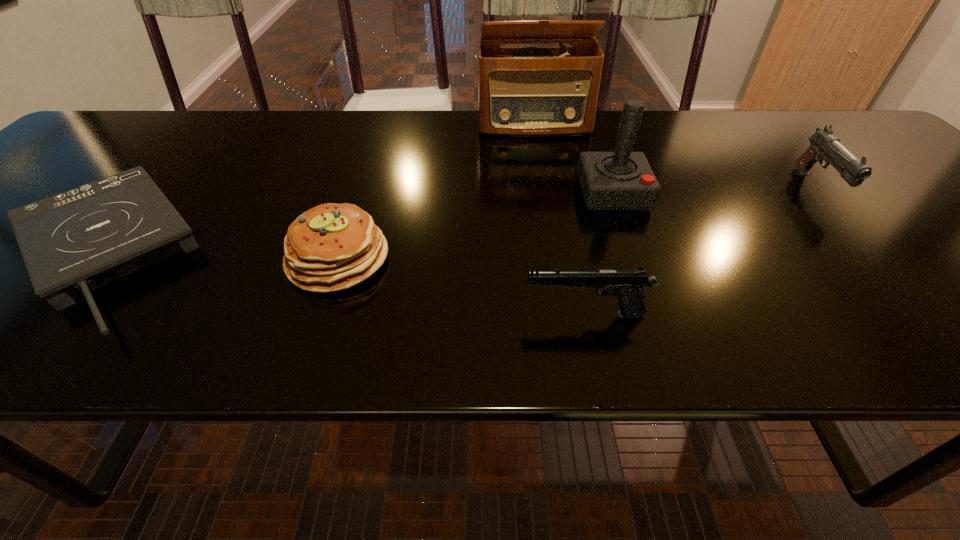
This screenshot has width=960, height=540. What are the coordinates of `empty space that is in between the nearer gun and the fifth object from right to left` in the screenshot? It's located at (462, 286).

I want to click on free spot between the left gun and the fifth shortest object, so click(x=599, y=253).

I want to click on unoccupied position between the fifth object from right to left and the left gun, so click(462, 286).

Identify the location of vacant area that lies between the tallest object and the left gun. This screenshot has width=960, height=540. (560, 219).

This screenshot has height=540, width=960. I want to click on free spot between the second tallest object and the nearer gun, so click(599, 253).

Select which object appears as the fifth closest to the nearer gun. Please provide its 2D coordinates. Your answer should be formatted as a tuple, i.e. [(x, y)], where the tuple contains the x and y coordinates of a point satisfying the conditions above.

[(73, 242)]

I want to click on the closest object relative to the fifth object from right to left, so click(73, 242).

You are a GUI agent. You are given a task and a screenshot of the screen. Output one action in this format:
    pyautogui.click(x=<x>, y=<y>)
    Task: Click on the vacant area in the image that satisfies the following two spatial constraints: 1. in the direction the right gun is aimed; 2. at the aiming end of the left gun
    This screenshot has width=960, height=540.
    Given the screenshot: What is the action you would take?
    pos(932,314)